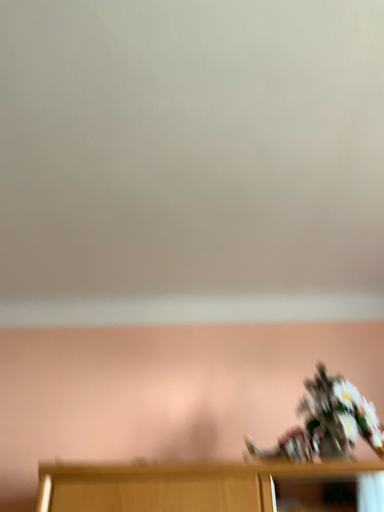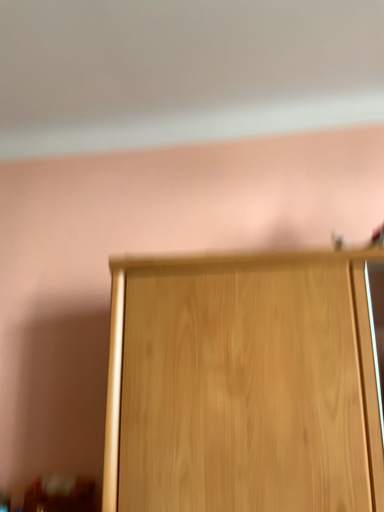
Question: How did the camera likely rotate when shooting the video?

Choices:
 (A) rotated upward
 (B) rotated downward

Answer: (B)